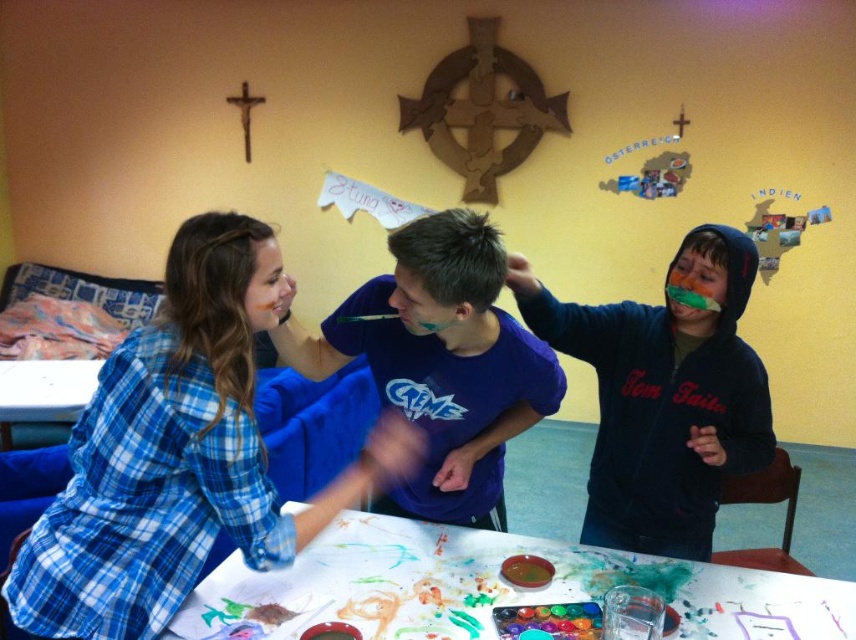
Looking at this image, you are organizing a craft activity and need to decide if the dark blue hoodie at center can be placed on top of the white paper at center without covering the entire paper. Based on their sizes, what do you think?

The dark blue hoodie at center is larger than the white paper at center, so placing it on top would cover the entire paper.